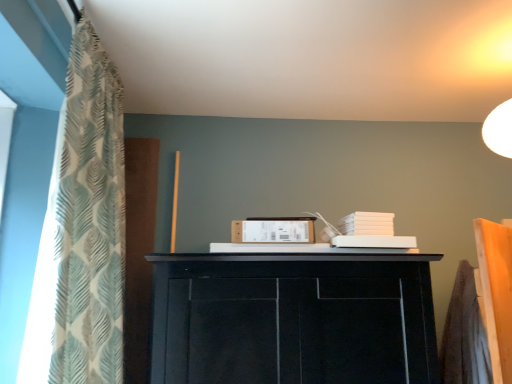
This screenshot has height=384, width=512. What do you see at coordinates (90, 220) in the screenshot?
I see `patterned fabric curtain at left` at bounding box center [90, 220].

What is the approximate height of patterned fabric curtain at left?

patterned fabric curtain at left is 3.67 feet in height.

Where is `patterned fabric curtain at left`? The image size is (512, 384). patterned fabric curtain at left is located at coordinates (90, 220).

Where is `patterned fabric curtain at left`? This screenshot has height=384, width=512. patterned fabric curtain at left is located at coordinates (90, 220).